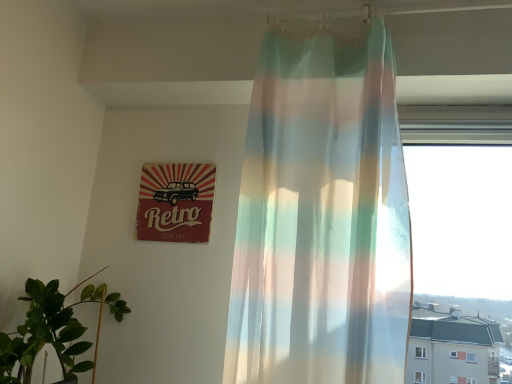
This screenshot has width=512, height=384. What do you see at coordinates (176, 202) in the screenshot?
I see `retro paper sign at upper left` at bounding box center [176, 202].

Identify the location of green leafy plant at lower left. The height and width of the screenshot is (384, 512). (54, 330).

Between translucent pastel curtain at center and green leafy plant at lower left, which one is positioned in front?

translucent pastel curtain at center.

Considering the sizes of translucent pastel curtain at center and green leafy plant at lower left in the image, is translucent pastel curtain at center taller or shorter than green leafy plant at lower left?

Clearly, translucent pastel curtain at center is taller compared to green leafy plant at lower left.

Choose the correct answer: Is translucent pastel curtain at center inside green leafy plant at lower left or outside it?

translucent pastel curtain at center is not enclosed by green leafy plant at lower left.

From a real-world perspective, between retro paper sign at upper left and green leafy plant at lower left, who is vertically higher?

retro paper sign at upper left.

Considering the sizes of retro paper sign at upper left and green leafy plant at lower left in the image, is retro paper sign at upper left taller or shorter than green leafy plant at lower left?

Clearly, retro paper sign at upper left is shorter compared to green leafy plant at lower left.

From the image's perspective, is retro paper sign at upper left positioned above or below green leafy plant at lower left?

From the image's perspective, retro paper sign at upper left appears above green leafy plant at lower left.

Considering the points (206, 210) and (33, 318), which point is behind, point (206, 210) or point (33, 318)?

The point (206, 210) is behind.

Based on their sizes in the image, would you say green leafy plant at lower left is bigger or smaller than translucent pastel curtain at center?

Clearly, green leafy plant at lower left is smaller in size than translucent pastel curtain at center.

Considering the relative sizes of green leafy plant at lower left and translucent pastel curtain at center in the image provided, is green leafy plant at lower left shorter than translucent pastel curtain at center?

Correct, green leafy plant at lower left is not as tall as translucent pastel curtain at center.

Between point (33, 340) and point (291, 157), which one is positioned in front?

The point (33, 340) is closer.

Looking at this image, is retro paper sign at upper left closer to camera compared to translucent pastel curtain at center?

That is False.

Which of these two, retro paper sign at upper left or translucent pastel curtain at center, stands shorter?

retro paper sign at upper left.

Is the surface of retro paper sign at upper left in direct contact with translucent pastel curtain at center?

retro paper sign at upper left is not next to translucent pastel curtain at center, and they're not touching.

Does point (162, 188) come behind point (333, 118)?

Yes, point (162, 188) is behind point (333, 118).

Is green leafy plant at lower left placed right next to retro paper sign at upper left?

They are not placed beside each other.

Does green leafy plant at lower left appear on the left side of retro paper sign at upper left?

Correct, you'll find green leafy plant at lower left to the left of retro paper sign at upper left.

I want to click on signage that is behind the green leafy plant at lower left, so click(176, 202).

Considering the relative sizes of green leafy plant at lower left and retro paper sign at upper left in the image provided, is green leafy plant at lower left taller than retro paper sign at upper left?

Indeed, green leafy plant at lower left has a greater height compared to retro paper sign at upper left.

From the image's perspective, is translucent pastel curtain at center under retro paper sign at upper left?

Incorrect, from the image's perspective, translucent pastel curtain at center is higher than retro paper sign at upper left.

Considering the positions of points (307, 123) and (150, 236), is point (307, 123) closer to camera compared to point (150, 236)?

Yes, it is in front of point (150, 236).

Can you confirm if translucent pastel curtain at center is shorter than retro paper sign at upper left?

No.

At what (x,y) coordinates should I click in order to perform the action: click on curtain above the green leafy plant at lower left (from the image's perspective). Please return your answer as a coordinate pair (x, y). Image resolution: width=512 pixels, height=384 pixels. Looking at the image, I should click on (322, 217).

Where is `signage on the right of green leafy plant at lower left`? The height and width of the screenshot is (384, 512). signage on the right of green leafy plant at lower left is located at coordinates (176, 202).

Considering their positions, is green leafy plant at lower left positioned further to translucent pastel curtain at center than retro paper sign at upper left?

green leafy plant at lower left.

Based on their spatial positions, is retro paper sign at upper left or green leafy plant at lower left closer to translucent pastel curtain at center?

retro paper sign at upper left.

From the image, which object appears to be farther from green leafy plant at lower left, translucent pastel curtain at center or retro paper sign at upper left?

Based on the image, translucent pastel curtain at center appears to be further to green leafy plant at lower left.

Estimate the real-world distances between objects in this image. Which object is further from retro paper sign at upper left, green leafy plant at lower left or translucent pastel curtain at center?

The object further to retro paper sign at upper left is translucent pastel curtain at center.

Estimate the real-world distances between objects in this image. Which object is closer to retro paper sign at upper left, translucent pastel curtain at center or green leafy plant at lower left?

Among the two, green leafy plant at lower left is located nearer to retro paper sign at upper left.

Estimate the real-world distances between objects in this image. Which object is further from green leafy plant at lower left, retro paper sign at upper left or translucent pastel curtain at center?

translucent pastel curtain at center lies further to green leafy plant at lower left than the other object.

This screenshot has height=384, width=512. In order to click on signage between green leafy plant at lower left and translucent pastel curtain at center in the horizontal direction in this screenshot , I will do click(176, 202).